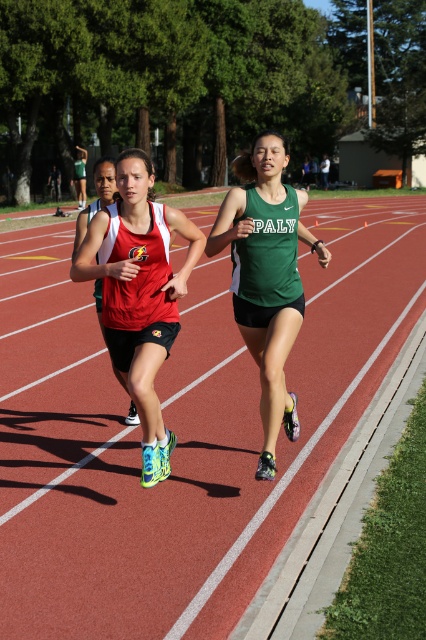
From the picture: Does matte red tank top at center appear under green matte tank top at center?

Yes, matte red tank top at center is below green matte tank top at center.

Which is more to the right, matte red tank top at center or green matte tank top at center?

green matte tank top at center

Measure the distance between matte red tank top at center and camera.

They are 5.02 meters apart.

Find the location of a particular element. The height and width of the screenshot is (640, 426). matte red tank top at center is located at coordinates (140, 294).

Can you confirm if red rubber track at center is thinner than matte red tank top at center?

Incorrect, red rubber track at center's width is not less than matte red tank top at center's.

Between point (11, 573) and point (109, 353), which one is positioned in front?

Point (11, 573)

Find the location of a particular element. The image size is (426, 640). red rubber track at center is located at coordinates (183, 435).

Which is more to the right, red rubber track at center or green matte tank top at center?

green matte tank top at center is more to the right.

Who is higher up, red rubber track at center or green matte tank top at center?

green matte tank top at center is above.

Does point (20, 381) come farther from viewer compared to point (271, 160)?

Yes, point (20, 381) is farther from viewer.

Find the location of a particular element. red rubber track at center is located at coordinates (183, 435).